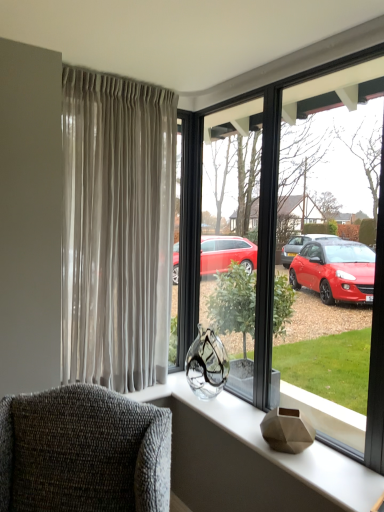
You are a GUI agent. You are given a task and a screenshot of the screen. Output one action in this format:
    pyautogui.click(x=<x>, y=<y>)
    Task: Click on the free point below transparent glass vase at center (from a real-world perspective)
    
    Given the screenshot: What is the action you would take?
    pyautogui.click(x=252, y=406)